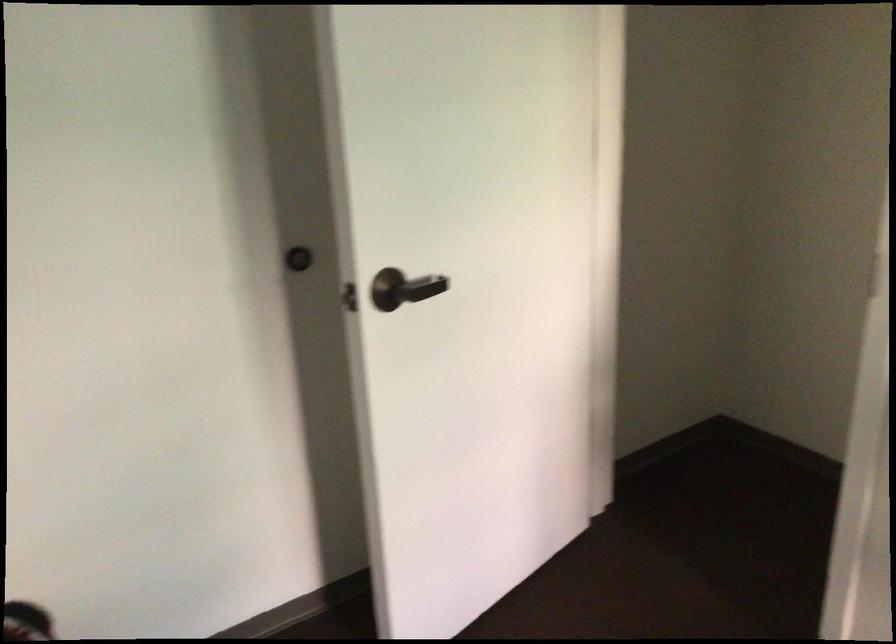
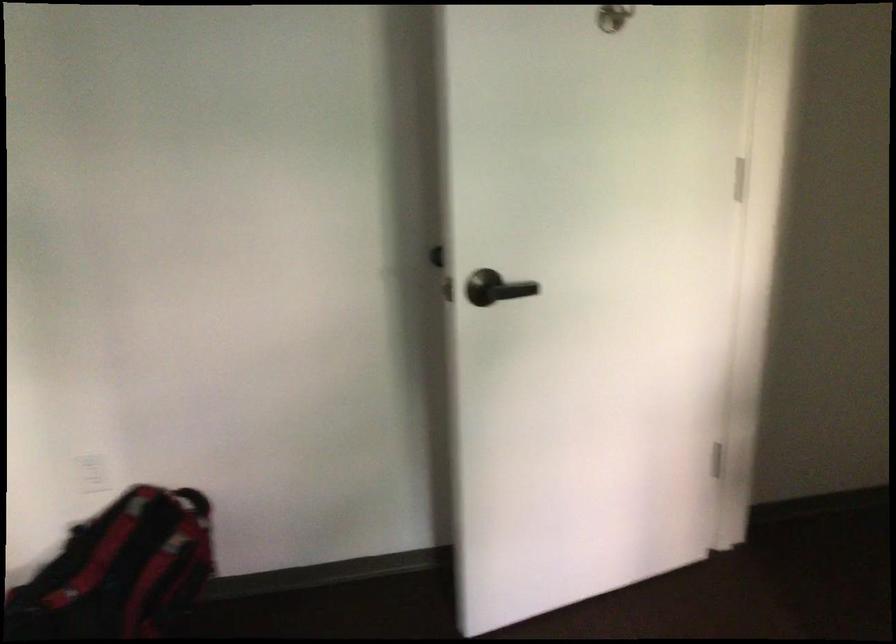
Question: How did the camera likely rotate?

Choices:
 (A) Left
 (B) Right
 (C) Up
 (D) Down

Answer: (A)